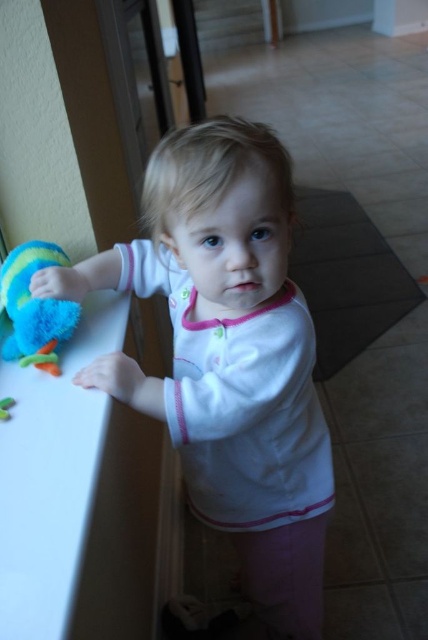
Who is more forward, (x=143, y=198) or (x=32, y=346)?

Point (x=32, y=346)

Is point (279, 408) less distant than point (51, 257)?

Yes.

This screenshot has width=428, height=640. What do you see at coordinates (228, 355) in the screenshot?
I see `white soft shirt at center` at bounding box center [228, 355].

Locate an element on the screen. The image size is (428, 640). white soft shirt at center is located at coordinates (228, 355).